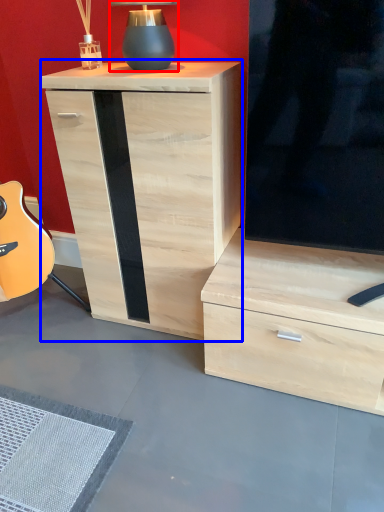
Question: Which object is closer to the camera taking this photo, table lamp (highlighted by a red box) or chest of drawers (highlighted by a blue box)?

Choices:
 (A) table lamp
 (B) chest of drawers

Answer: (B)